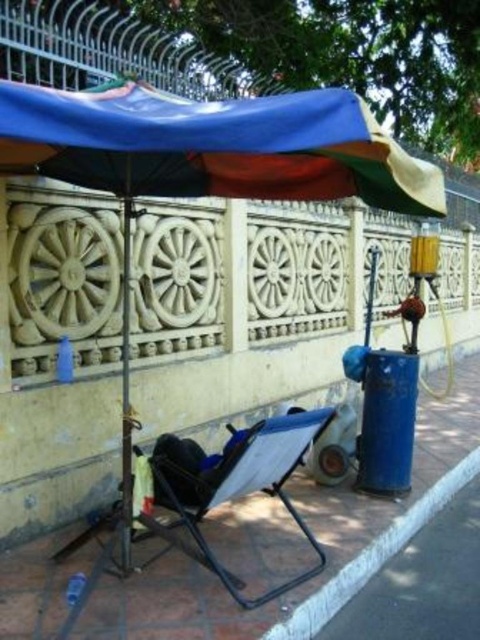
Question: Which object appears farthest from the camera in this image?

Choices:
 (A) blue fabric chair at lower center
 (B) blue fabric umbrella at upper center
 (C) blue fabric folding chair at center
 (D) polyester tarp at upper center

Answer: (C)

Question: Does blue fabric umbrella at upper center appear over polyester tarp at upper center?

Choices:
 (A) no
 (B) yes

Answer: (A)

Question: Which object is the farthest from the blue fabric chair at lower center?

Choices:
 (A) blue fabric folding chair at center
 (B) polyester tarp at upper center
 (C) blue fabric umbrella at upper center

Answer: (C)

Question: In this image, where is blue fabric umbrella at upper center located relative to blue fabric chair at lower center?

Choices:
 (A) left
 (B) right

Answer: (B)

Question: Considering the real-world distances, which object is farthest from the polyester tarp at upper center?

Choices:
 (A) blue fabric chair at lower center
 (B) metallic pole at center
 (C) blue fabric folding chair at center
 (D) blue fabric umbrella at upper center

Answer: (A)

Question: Is the position of polyester tarp at upper center less distant than that of blue fabric folding chair at center?

Choices:
 (A) no
 (B) yes

Answer: (B)